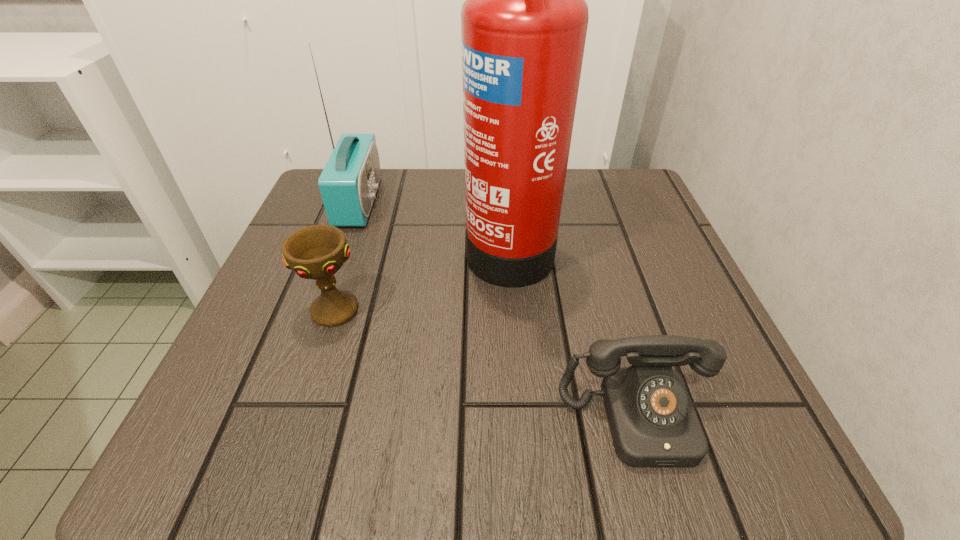
Image resolution: width=960 pixels, height=540 pixels. I want to click on the tallest object, so click(x=523, y=25).

The height and width of the screenshot is (540, 960). In order to click on radio receiver in this screenshot , I will do `click(348, 184)`.

Locate an element on the screen. the third tallest object is located at coordinates (317, 252).

Find the location of a particular element. Image resolution: width=960 pixels, height=540 pixels. telephone is located at coordinates (653, 422).

Locate an element on the screen. the shortest object is located at coordinates (653, 422).

I want to click on vacant region located on the surface of the tallest object, so click(x=409, y=245).

Locate an element on the screen. vacant space positioned 0.190m on the surface of the tallest object is located at coordinates (368, 245).

In order to click on vacant space located on the surface of the tallest object in this screenshot , I will do `click(342, 245)`.

Where is `free location located on the front panel of the second tallest object`? This screenshot has width=960, height=540. free location located on the front panel of the second tallest object is located at coordinates (522, 202).

Find the location of a particular element. This screenshot has height=540, width=960. blank space located on the right of the chalice is located at coordinates (590, 310).